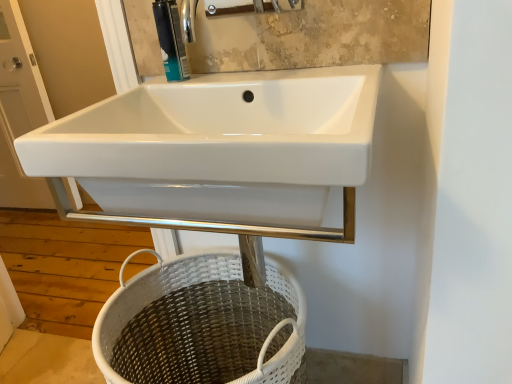
Describe the element at coordinates (170, 40) in the screenshot. This screenshot has width=512, height=384. I see `matte plastic soap dispenser at upper center` at that location.

You are a GUI agent. You are given a task and a screenshot of the screen. Output one action in this format:
    pyautogui.click(x=<x>, y=<y>)
    Task: Click on the matte plastic soap dispenser at upper center
    The height and width of the screenshot is (384, 512).
    Given the screenshot: What is the action you would take?
    (170, 40)

Based on the photo, is matte plastic soap dispenser at upper center not close to white wicker basket at lower center?

No, there isn't a large distance between matte plastic soap dispenser at upper center and white wicker basket at lower center.

Could white wicker basket at lower center be considered to be inside matte plastic soap dispenser at upper center?

That's incorrect, white wicker basket at lower center is not inside matte plastic soap dispenser at upper center.

Could you tell me if matte plastic soap dispenser at upper center is turned towards white wicker basket at lower center?

No.

Is white glossy sink at upper left taller or shorter than white wicker basket at lower center?

white glossy sink at upper left is taller than white wicker basket at lower center.

Is white glossy sink at upper left wider than white wicker basket at lower center?

No.

Considering the positions of points (33, 128) and (118, 349), is point (33, 128) farther from camera compared to point (118, 349)?

Yes, it is.

Is white wicker basket at lower center at the right side of white glossy sink at upper left?

Yes.

Considering the positions of point (218, 348) and point (14, 202), is point (218, 348) closer or farther from the camera than point (14, 202)?

Point (218, 348) is positioned closer to the camera compared to point (14, 202).

Is white wicker basket at lower center not near white glossy sink at upper left?

Absolutely, white wicker basket at lower center is distant from white glossy sink at upper left.

Is white wicker basket at lower center not inside matte plastic soap dispenser at upper center?

Yes, white wicker basket at lower center is not within matte plastic soap dispenser at upper center.

Could you tell me if white wicker basket at lower center is facing matte plastic soap dispenser at upper center?

No, white wicker basket at lower center is not aimed at matte plastic soap dispenser at upper center.

Based on the photo, which of these two, white wicker basket at lower center or matte plastic soap dispenser at upper center, is thinner?

Thinner between the two is matte plastic soap dispenser at upper center.

Is white wicker basket at lower center not close to matte plastic soap dispenser at upper center?

No, white wicker basket at lower center is in close proximity to matte plastic soap dispenser at upper center.

Does white glossy sink at upper left have a smaller size compared to matte plastic soap dispenser at upper center?

No.

Is white glossy sink at upper left facing towards matte plastic soap dispenser at upper center?

No, white glossy sink at upper left is not facing towards matte plastic soap dispenser at upper center.

What's the angular difference between white glossy sink at upper left and matte plastic soap dispenser at upper center's facing directions?

The angle between the facing direction of white glossy sink at upper left and the facing direction of matte plastic soap dispenser at upper center is 0.185 degrees.

From the image's perspective, is matte plastic soap dispenser at upper center beneath white glossy sink at upper left?

Yes, from the image's perspective, matte plastic soap dispenser at upper center is below white glossy sink at upper left.

From a real-world perspective, is matte plastic soap dispenser at upper center above or below white glossy sink at upper left?

Clearly, from a real-world perspective, matte plastic soap dispenser at upper center is above white glossy sink at upper left.

Consider the image. Considering the sizes of matte plastic soap dispenser at upper center and white glossy sink at upper left in the image, is matte plastic soap dispenser at upper center wider or thinner than white glossy sink at upper left?

matte plastic soap dispenser at upper center is thinner than white glossy sink at upper left.

Would you say matte plastic soap dispenser at upper center is inside or outside white glossy sink at upper left?

matte plastic soap dispenser at upper center lies outside white glossy sink at upper left.

Where is `soap dispenser that is above the white wicker basket at lower center (from a real-world perspective)`? The height and width of the screenshot is (384, 512). soap dispenser that is above the white wicker basket at lower center (from a real-world perspective) is located at coordinates (170, 40).

The width and height of the screenshot is (512, 384). I want to click on screen door located above the white wicker basket at lower center (from the image's perspective), so click(x=19, y=110).

Estimate the real-world distances between objects in this image. Which object is closer to white wicker basket at lower center, white glossy sink at upper left or matte plastic soap dispenser at upper center?

Among the two, matte plastic soap dispenser at upper center is located nearer to white wicker basket at lower center.

Which object lies further to the anchor point white glossy sink at upper left, white wicker basket at lower center or matte plastic soap dispenser at upper center?

matte plastic soap dispenser at upper center.

When comparing their distances from matte plastic soap dispenser at upper center, does white glossy sink at upper left or white wicker basket at lower center seem further?

white glossy sink at upper left is positioned further to the anchor matte plastic soap dispenser at upper center.

Looking at the image, which one is located closer to white glossy sink at upper left, matte plastic soap dispenser at upper center or white wicker basket at lower center?

white wicker basket at lower center.

When comparing their distances from white wicker basket at lower center, does matte plastic soap dispenser at upper center or white glossy sink at upper left seem closer?

matte plastic soap dispenser at upper center is positioned closer to the anchor white wicker basket at lower center.

From the picture: Estimate the real-world distances between objects in this image. Which object is further from matte plastic soap dispenser at upper center, white wicker basket at lower center or white glossy sink at upper left?

Among the two, white glossy sink at upper left is located further to matte plastic soap dispenser at upper center.

This screenshot has height=384, width=512. Identify the location of soap dispenser between white wicker basket at lower center and white glossy sink at upper left from front to back. (170, 40).